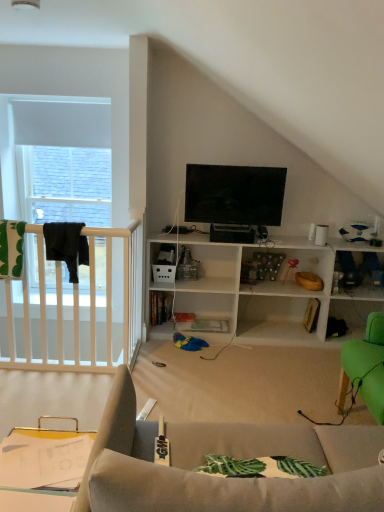
The image size is (384, 512). In order to click on vacant area on top of clear plastic tray at lower left (from a real-world perspective) in this screenshot , I will do `click(45, 446)`.